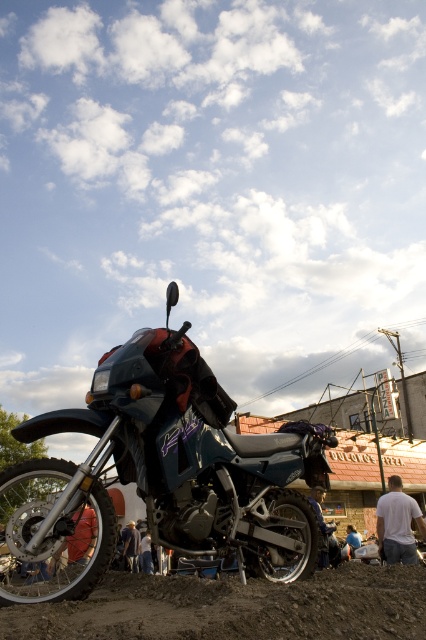
You are a delivery person standing at the location of the white matte shirt at lower right. You need to deliver a package to the rider of the metallic blue motorcycle at center. The package can only be delivered if you can reach the motorcycle within 7 meters. Can you successfully deliver the package?

The metallic blue motorcycle at center is 6.75 meters away from the white matte shirt at lower right. Since 6.75 meters is less than 7 meters, you can successfully deliver the package to the rider of the metallic blue motorcycle at center.

You are standing in front of the dirt bike and want to know which of the two points, point (166, 637) or point (420, 531), is closer to you. Can you determine this based on their positions?

Point (166, 637) is closer to the viewer than point (420, 531).

You are a photographer planning to take a closeup shot of the brown dirt track at lower center and the white matte shirt at lower right. Based on their sizes, which object should you focus on to ensure both fit within the frame without needing to adjust the camera angle?

The brown dirt track at lower center is bigger than the white matte shirt at lower right, so focusing on the brown dirt track at lower center will ensure both objects fit within the frame since it accommodates the smaller white matte shirt at lower right as well.